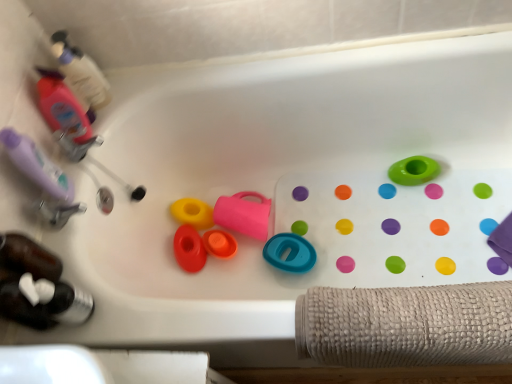
Describe the element at coordinates (37, 165) in the screenshot. I see `purple matte bottle at left` at that location.

Locate an element on the screen. This screenshot has width=512, height=384. orange matte cup at center, which is the fourth toy in right-to-left order is located at coordinates (220, 244).

Image resolution: width=512 pixels, height=384 pixels. What do you see at coordinates (192, 213) in the screenshot?
I see `yellow rubber toy at center, the second toy positioned from the left` at bounding box center [192, 213].

This screenshot has width=512, height=384. Describe the element at coordinates (66, 115) in the screenshot. I see `translucent pink bottle at upper left, acting as the second bottle starting from the bottom` at that location.

What do you see at coordinates (290, 253) in the screenshot? I see `teal rubber ring at center, which is the second toy in right-to-left order` at bounding box center [290, 253].

Find the location of a particular element. purple matte bottle at left is located at coordinates (37, 165).

Who is bigger, teal rubber ring at center, which is the second toy in right-to-left order, or yellow rubber toy at center, placed as the 5th toy when sorted from right to left?

With larger size is teal rubber ring at center, which is the second toy in right-to-left order.

Are teal rubber ring at center, which is the fifth toy in left-to-right order, and yellow rubber toy at center, placed as the 5th toy when sorted from right to left, making contact?

No, teal rubber ring at center, which is the fifth toy in left-to-right order, is not next to yellow rubber toy at center, placed as the 5th toy when sorted from right to left.

In the scene shown: Which object is positioned more to the right, teal rubber ring at center, which is the fifth toy in left-to-right order, or yellow rubber toy at center, placed as the 5th toy when sorted from right to left?

From the viewer's perspective, teal rubber ring at center, which is the fifth toy in left-to-right order, appears more on the right side.

In the scene shown: Considering the sizes of objects teal rubber ring at center, which is the second toy in right-to-left order, and translucent plastic bottle at upper left, the first bottle positioned from the top, in the image provided, who is wider, teal rubber ring at center, which is the second toy in right-to-left order, or translucent plastic bottle at upper left, the first bottle positioned from the top,?

With larger width is teal rubber ring at center, which is the second toy in right-to-left order.

Starting from the translucent plastic bottle at upper left, the first bottle positioned from the top, which toy is the 5th one to the right? Please provide its 2D coordinates.

[(290, 253)]

From a real-world perspective, is teal rubber ring at center, which is the fifth toy in left-to-right order, below translucent plastic bottle at upper left, the first bottle positioned from the top?

Yes, from a real-world perspective, teal rubber ring at center, which is the fifth toy in left-to-right order, is under translucent plastic bottle at upper left, the first bottle positioned from the top.

Can you confirm if teal rubber ring at center, which is the fifth toy in left-to-right order, is taller than translucent plastic bottle at upper left, placed as the 3th bottle when sorted from bottom to top?

No, teal rubber ring at center, which is the fifth toy in left-to-right order, is not taller than translucent plastic bottle at upper left, placed as the 3th bottle when sorted from bottom to top.

What's the angular difference between pink rubber cup at center, which ranks as the third toy in right-to-left order, and green rubber ring at upper right, positioned as the sixth toy in left-to-right order,'s facing directions?

There is a 7.99e-05-degree angle between the facing directions of pink rubber cup at center, which ranks as the third toy in right-to-left order, and green rubber ring at upper right, positioned as the sixth toy in left-to-right order.

Is pink rubber cup at center, the fourth toy from the left, positioned beyond the bounds of green rubber ring at upper right, which ranks as the 1th toy in right-to-left order?

Yes, pink rubber cup at center, the fourth toy from the left, is not within green rubber ring at upper right, which ranks as the 1th toy in right-to-left order.

Is pink rubber cup at center, the fourth toy from the left, facing away from green rubber ring at upper right, positioned as the sixth toy in left-to-right order?

No, pink rubber cup at center, the fourth toy from the left, is not facing away from green rubber ring at upper right, positioned as the sixth toy in left-to-right order.

Find the location of a particular element. This screenshot has height=384, width=512. toy that is the 1st object directly below the green rubber ring at upper right, positioned as the sixth toy in left-to-right order (from a real-world perspective) is located at coordinates (243, 214).

Can you confirm if green rubber ring at upper right, positioned as the sixth toy in left-to-right order, is positioned to the right of yellow rubber toy at center, placed as the 5th toy when sorted from right to left?

Yes, green rubber ring at upper right, positioned as the sixth toy in left-to-right order, is to the right of yellow rubber toy at center, placed as the 5th toy when sorted from right to left.

In the scene shown: Is green rubber ring at upper right, which ranks as the 1th toy in right-to-left order, surrounding yellow rubber toy at center, placed as the 5th toy when sorted from right to left?

No, yellow rubber toy at center, placed as the 5th toy when sorted from right to left, is not surrounded by green rubber ring at upper right, which ranks as the 1th toy in right-to-left order.

From the image's perspective, relative to yellow rubber toy at center, placed as the 5th toy when sorted from right to left, is green rubber ring at upper right, which ranks as the 1th toy in right-to-left order, above or below?

From the image's perspective, green rubber ring at upper right, which ranks as the 1th toy in right-to-left order, appears above yellow rubber toy at center, placed as the 5th toy when sorted from right to left.

Which is in front, point (426, 166) or point (186, 215)?

Point (426, 166)

From the image's perspective, between purple matte bottle at left and pink rubber cup at center, which ranks as the third toy in right-to-left order, which one is located above?

purple matte bottle at left is shown above in the image.

Consider the image. Based on their sizes in the image, would you say purple matte bottle at left is bigger or smaller than pink rubber cup at center, the fourth toy from the left?

Clearly, purple matte bottle at left is smaller in size than pink rubber cup at center, the fourth toy from the left.

Is point (47, 183) positioned in front of point (260, 204)?

Yes, it is.

Considering the relative sizes of purple matte bottle at left and pink rubber cup at center, the fourth toy from the left, in the image provided, is purple matte bottle at left shorter than pink rubber cup at center, the fourth toy from the left,?

No, purple matte bottle at left is not shorter than pink rubber cup at center, the fourth toy from the left.

Is translucent pink bottle at upper left, the second bottle in the top-to-bottom sequence, far from pink rubber cup at center, which ranks as the third toy in right-to-left order?

No, translucent pink bottle at upper left, the second bottle in the top-to-bottom sequence, is not far from pink rubber cup at center, which ranks as the third toy in right-to-left order.

Is translucent pink bottle at upper left, the second bottle in the top-to-bottom sequence, positioned with its back to pink rubber cup at center, the fourth toy from the left?

No.

Does translucent pink bottle at upper left, acting as the second bottle starting from the bottom, have a lesser width compared to pink rubber cup at center, which ranks as the third toy in right-to-left order?

Yes.

Between translucent pink bottle at upper left, acting as the second bottle starting from the bottom, and pink rubber cup at center, the fourth toy from the left, which one is positioned behind?

pink rubber cup at center, the fourth toy from the left, is more distant.

From the image's perspective, is purple matte bottle at left located above translucent plastic bottle at upper left, placed as the 3th bottle when sorted from bottom to top?

No, from the image's perspective, purple matte bottle at left is not over translucent plastic bottle at upper left, placed as the 3th bottle when sorted from bottom to top.

From a real-world perspective, does purple matte bottle at left sit lower than translucent plastic bottle at upper left, the first bottle positioned from the top?

No, from a real-world perspective, purple matte bottle at left is not below translucent plastic bottle at upper left, the first bottle positioned from the top.

Is purple matte bottle at left with translucent plastic bottle at upper left, placed as the 3th bottle when sorted from bottom to top?

No.

Considering the sizes of objects purple matte bottle at left and translucent plastic bottle at upper left, placed as the 3th bottle when sorted from bottom to top, in the image provided, who is shorter, purple matte bottle at left or translucent plastic bottle at upper left, placed as the 3th bottle when sorted from bottom to top,?

translucent plastic bottle at upper left, placed as the 3th bottle when sorted from bottom to top, is shorter.

Locate an element on the screen. The image size is (512, 384). the 3rd toy counting from the right side of the yellow rubber toy at center, the second toy positioned from the left is located at coordinates (290, 253).

You are a GUI agent. You are given a task and a screenshot of the screen. Output one action in this format:
    pyautogui.click(x=<x>, y=<y>)
    Task: Click on the toy that is the 1st one when counting backward from the translucent plastic bottle at upper left, placed as the 3th bottle when sorted from bottom to top
    The width and height of the screenshot is (512, 384).
    Given the screenshot: What is the action you would take?
    pyautogui.click(x=290, y=253)

Looking at the image, which one is located closer to rubberized orange bath plug at center, which appears as the 1th toy when viewed from the left, pink rubber cup at center, the fourth toy from the left, or purple matte bottle at left?

pink rubber cup at center, the fourth toy from the left, is closer to rubberized orange bath plug at center, which appears as the 1th toy when viewed from the left.

Based on their spatial positions, is green rubber ring at upper right, positioned as the sixth toy in left-to-right order, or rubberized orange bath plug at center, the 6th toy viewed from the right, further from teal rubber ring at center, which is the second toy in right-to-left order?

The object further to teal rubber ring at center, which is the second toy in right-to-left order, is green rubber ring at upper right, positioned as the sixth toy in left-to-right order.

Looking at the image, which one is located further to translucent pink bottle at upper left, acting as the second bottle starting from the bottom, translucent plastic bottle at lower left, the third bottle in the top-to-bottom sequence, or pink rubber cup at center, which ranks as the third toy in right-to-left order?

Among the two, pink rubber cup at center, which ranks as the third toy in right-to-left order, is located further to translucent pink bottle at upper left, acting as the second bottle starting from the bottom.

Estimate the real-world distances between objects in this image. Which object is closer to translucent pink bottle at upper left, acting as the second bottle starting from the bottom, rubberized orange bath plug at center, the 6th toy viewed from the right, or pink rubber cup at center, the fourth toy from the left?

Among the two, rubberized orange bath plug at center, the 6th toy viewed from the right, is located nearer to translucent pink bottle at upper left, acting as the second bottle starting from the bottom.

Considering their positions, is yellow rubber toy at center, placed as the 5th toy when sorted from right to left, positioned closer to purple matte bottle at left than translucent pink bottle at upper left, the second bottle in the top-to-bottom sequence?

translucent pink bottle at upper left, the second bottle in the top-to-bottom sequence.

Based on their spatial positions, is translucent pink bottle at upper left, the second bottle in the top-to-bottom sequence, or teal rubber ring at center, which is the fifth toy in left-to-right order, further from pink rubber cup at center, which ranks as the third toy in right-to-left order?

Based on the image, translucent pink bottle at upper left, the second bottle in the top-to-bottom sequence, appears to be further to pink rubber cup at center, which ranks as the third toy in right-to-left order.

Estimate the real-world distances between objects in this image. Which object is further from beige textured towel at lower right, yellow rubber toy at center, the second toy positioned from the left, or purple matte bottle at left?

Based on the image, purple matte bottle at left appears to be further to beige textured towel at lower right.

Based on the photo, when comparing their distances from purple matte bottle at left, does beige textured towel at lower right or orange matte cup at center, which appears as the third toy when viewed from the left, seem further?

The object further to purple matte bottle at left is beige textured towel at lower right.

At what (x,y) coordinates should I click in order to perform the action: click on toy between orange matte cup at center, which appears as the third toy when viewed from the left, and teal rubber ring at center, which is the second toy in right-to-left order. Please return your answer as a coordinate pair (x, y). The image size is (512, 384). Looking at the image, I should click on (243, 214).

Identify the location of bath towel situated between rubberized orange bath plug at center, the 6th toy viewed from the right, and green rubber ring at upper right, which ranks as the 1th toy in right-to-left order, from left to right. tap(406, 325).

Where is `toy between pink rubber cup at center, the fourth toy from the left, and green rubber ring at upper right, which ranks as the 1th toy in right-to-left order`? The image size is (512, 384). toy between pink rubber cup at center, the fourth toy from the left, and green rubber ring at upper right, which ranks as the 1th toy in right-to-left order is located at coordinates (290, 253).

The width and height of the screenshot is (512, 384). Find the location of `toiletry between translucent pink bottle at upper left, acting as the second bottle starting from the bottom, and translucent plastic bottle at lower left, the third bottle in the top-to-bottom sequence, from top to bottom`. toiletry between translucent pink bottle at upper left, acting as the second bottle starting from the bottom, and translucent plastic bottle at lower left, the third bottle in the top-to-bottom sequence, from top to bottom is located at coordinates (37, 165).